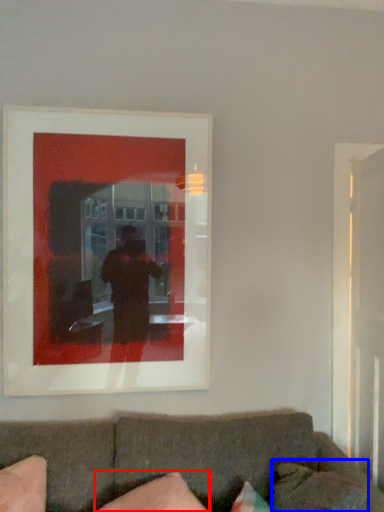
Question: Which of the following is the farthest to the observer, pillow (highlighted by a red box) or pillow (highlighted by a blue box)?

Choices:
 (A) pillow
 (B) pillow

Answer: (B)